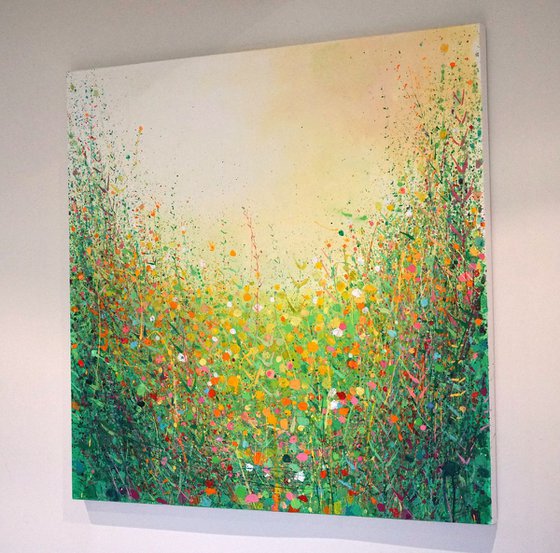
You are a GUI agent. You are given a task and a screenshot of the screen. Output one action in this format:
    pyautogui.click(x=<x>, y=<y>)
    Task: Click on the clear wall to the right of painting
    The width and height of the screenshot is (560, 553).
    Given the screenshot: What is the action you would take?
    pyautogui.click(x=519, y=314)